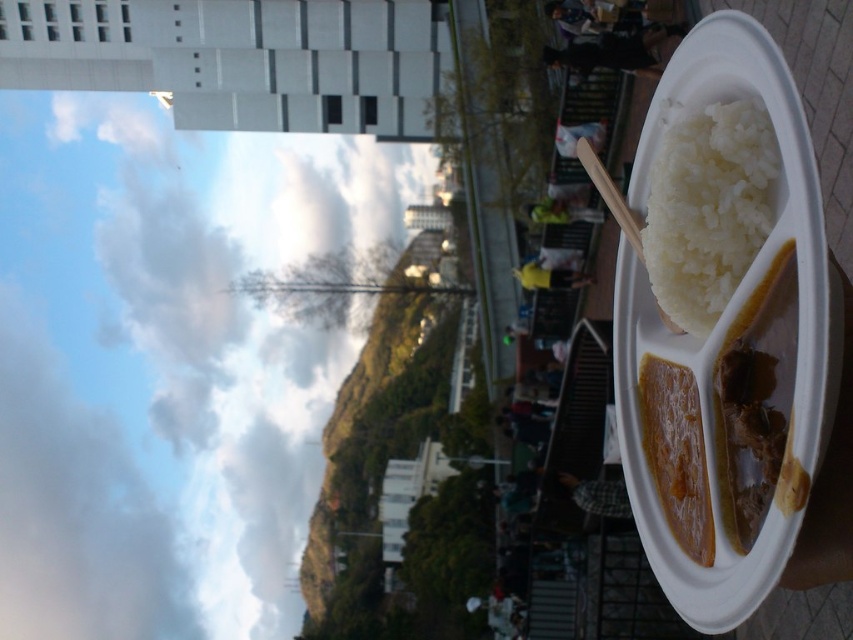
Question: Observing the image, what is the correct spatial positioning of yellow fabric at center in reference to green fabric bag at center?

Choices:
 (A) below
 (B) above

Answer: (A)

Question: Which object is positioned farthest from the white matte person at center?

Choices:
 (A) brown glossy curry at upper right
 (B) white matte rice at upper right
 (C) green fabric bag at center

Answer: (B)

Question: Does white matte rice at upper right have a smaller size compared to white matte person at center?

Choices:
 (A) yes
 (B) no

Answer: (A)

Question: Which point is closer to the camera taking this photo?

Choices:
 (A) (701, 504)
 (B) (550, 218)

Answer: (A)

Question: Which of the following is the farthest from the observer?

Choices:
 (A) yellow fabric at center
 (B) brown glossy curry at upper right
 (C) white matte rice at upper right
 (D) plaid fabric shirt at center

Answer: (A)

Question: Is brown glossy meat at upper right thinner than white matte person at center?

Choices:
 (A) no
 (B) yes

Answer: (B)